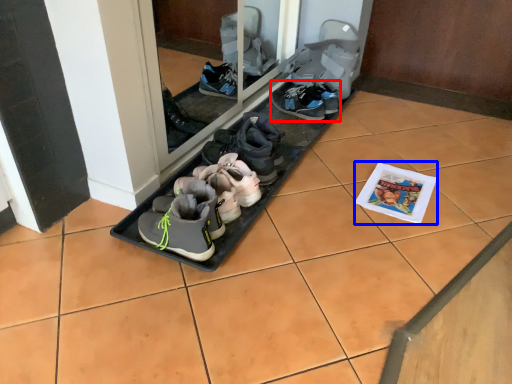
Question: Which object is further to the camera taking this photo, footwear (highlighted by a red box) or magazine (highlighted by a blue box)?

Choices:
 (A) footwear
 (B) magazine

Answer: (A)